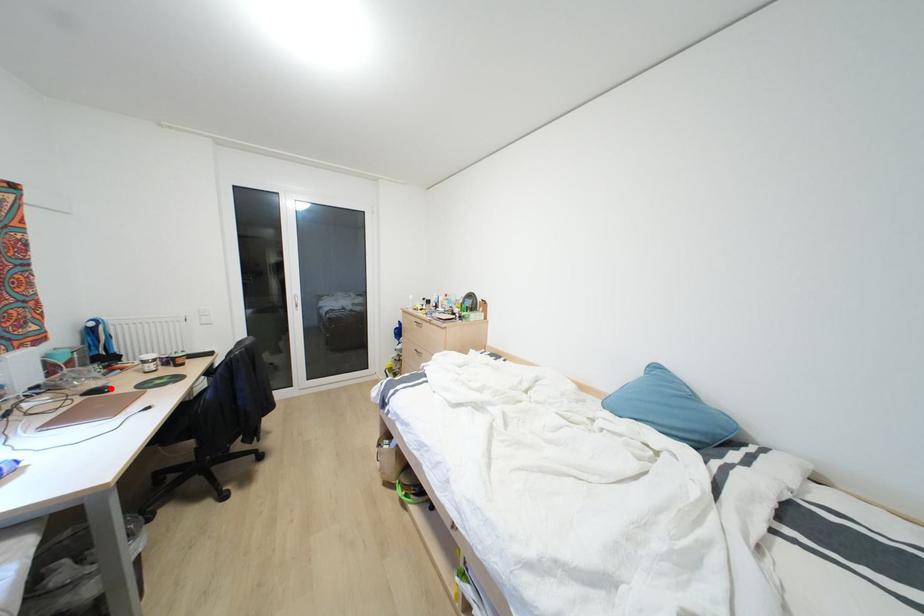
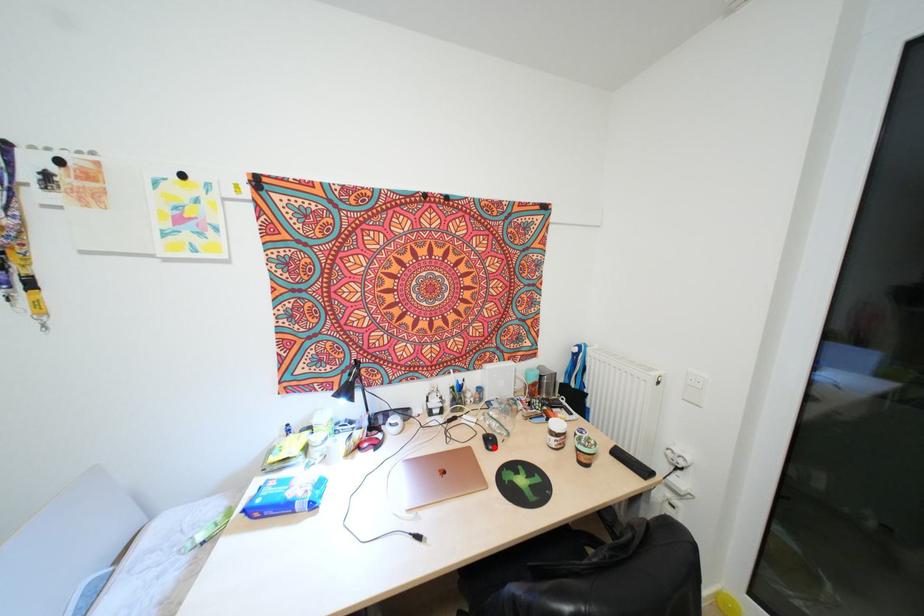
I am providing you with two images of the same scene from different viewpoints. A red point is marked on the first image and another point is marked on the second image. Is the marked point in image1 the same physical position as the marked point in image2?

Yes